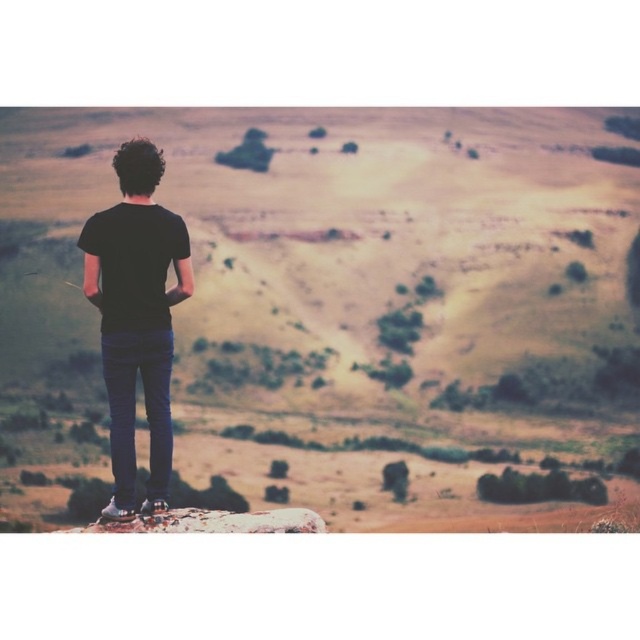
Question: Which object is closer to the camera taking this photo?

Choices:
 (A) desert sand at center
 (B) smooth beige rock at center

Answer: (B)

Question: Which point appears farthest from the camera in this image?

Choices:
 (A) (115, 211)
 (B) (214, 512)
 (C) (374, 144)

Answer: (C)

Question: Which object is farther from the camera taking this photo?

Choices:
 (A) desert sand at center
 (B) smooth beige rock at center
 (C) black matte t-shirt at center

Answer: (A)

Question: Is desert sand at center bigger than smooth beige rock at center?

Choices:
 (A) yes
 (B) no

Answer: (A)

Question: Can you confirm if black matte t-shirt at center is wider than smooth beige rock at center?

Choices:
 (A) no
 (B) yes

Answer: (A)

Question: Is black matte t-shirt at center wider than smooth beige rock at center?

Choices:
 (A) no
 (B) yes

Answer: (A)